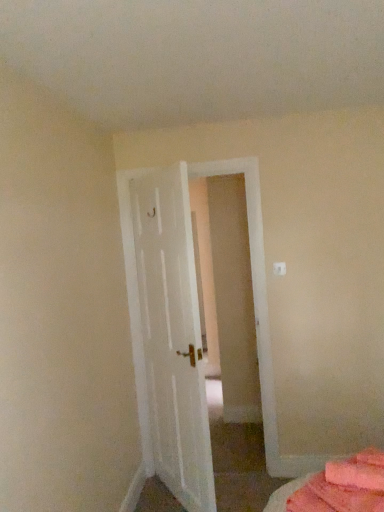
Question: Is white painted wood door at center to the right of pink fabric bed at lower right from the viewer's perspective?

Choices:
 (A) yes
 (B) no

Answer: (B)

Question: Is white painted wood door at center turned away from pink fabric bed at lower right?

Choices:
 (A) yes
 (B) no

Answer: (B)

Question: Considering the relative positions of white painted wood door at center and pink fabric bed at lower right in the image provided, is white painted wood door at center behind pink fabric bed at lower right?

Choices:
 (A) no
 (B) yes

Answer: (B)

Question: Would you say white painted wood door at center contains pink fabric bed at lower right?

Choices:
 (A) no
 (B) yes

Answer: (A)

Question: Does white painted wood door at center appear on the left side of pink fabric bed at lower right?

Choices:
 (A) yes
 (B) no

Answer: (A)

Question: Does white painted wood door at center turn towards pink fabric bed at lower right?

Choices:
 (A) yes
 (B) no

Answer: (B)

Question: Is pink fabric bed at lower right outside white painted wood door at center?

Choices:
 (A) no
 (B) yes

Answer: (B)

Question: From the image's perspective, is pink fabric bed at lower right over white painted wood door at center?

Choices:
 (A) no
 (B) yes

Answer: (A)

Question: Would you say pink fabric bed at lower right is a long distance from white painted wood door at center?

Choices:
 (A) yes
 (B) no

Answer: (A)

Question: Can you confirm if pink fabric bed at lower right is wider than white painted wood door at center?

Choices:
 (A) yes
 (B) no

Answer: (A)

Question: Can you confirm if pink fabric bed at lower right is taller than white painted wood door at center?

Choices:
 (A) yes
 (B) no

Answer: (B)

Question: Is pink fabric bed at lower right touching white painted wood door at center?

Choices:
 (A) yes
 (B) no

Answer: (B)

Question: In terms of width, does white painted wood door at center look wider or thinner when compared to pink fabric bed at lower right?

Choices:
 (A) wide
 (B) thin

Answer: (B)